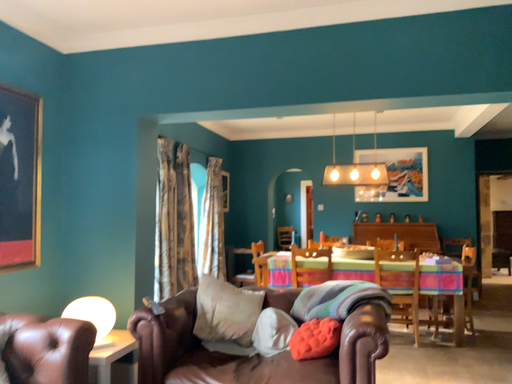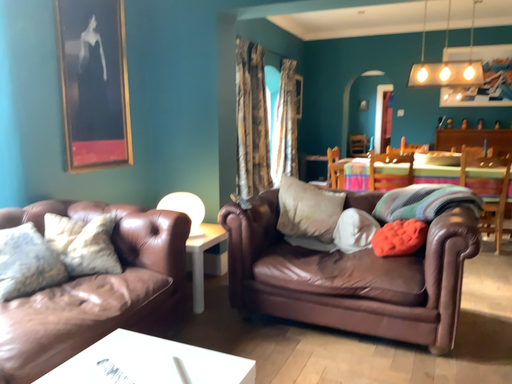
Question: Which way did the camera rotate in the video?

Choices:
 (A) rotated upward
 (B) rotated downward

Answer: (B)